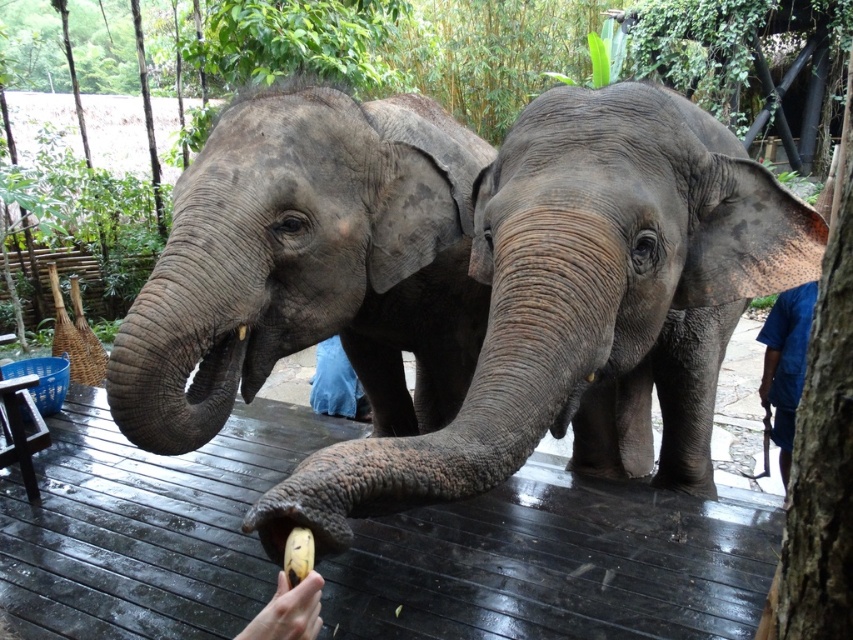
You are a small toy that is 10 cm tall. You are placed on the dark brown wooden deck at center. Can you safely jump down to the smooth skin hand at lower center without falling into the water?

The dark brown wooden deck at center is taller than the smooth skin hand at lower center, so yes, the toy can safely jump down to the smooth skin hand at lower center since it is lower than the deck.

You are standing at the center of the deck and want to reach the blue fabric shirt at right. Which direction should you move to get closer to it?

You should move to your right to get closer to the blue fabric shirt at right since it is located at the right side of the scene.